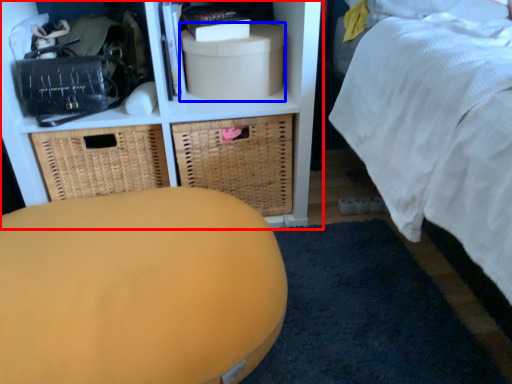
Question: Which point is further to the camera, shelf (highlighted by a red box) or storage box (highlighted by a blue box)?

Choices:
 (A) shelf
 (B) storage box

Answer: (B)